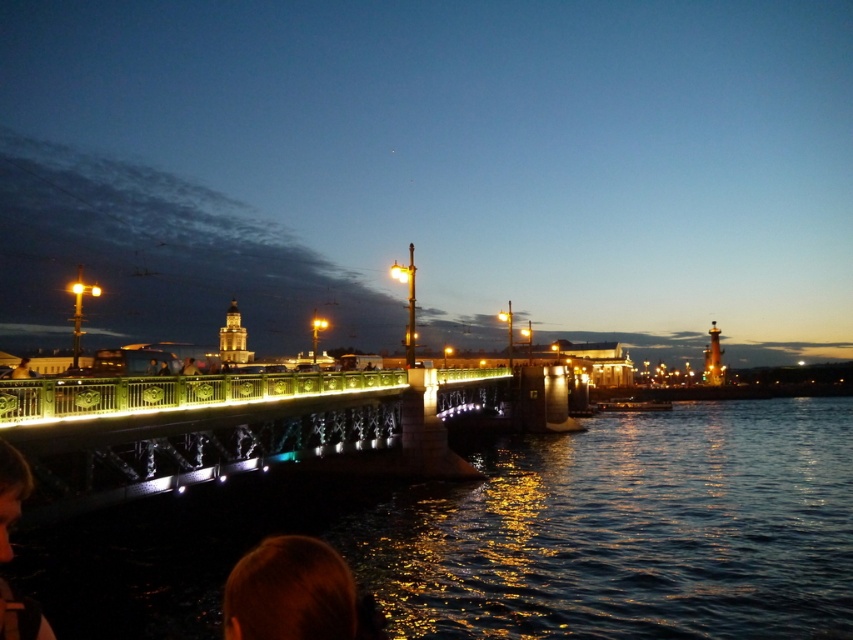
Question: Does illuminated metal bridge at center have a lesser width compared to light brown hair at lower left?

Choices:
 (A) yes
 (B) no

Answer: (B)

Question: Which point is closer to the camera taking this photo?

Choices:
 (A) (39, 624)
 (B) (167, 476)
 (C) (329, 636)

Answer: (A)

Question: Can you confirm if illuminated metal bridge at center is positioned above light brown hair at lower left?

Choices:
 (A) no
 (B) yes

Answer: (A)

Question: Estimate the real-world distances between objects in this image. Which object is closer to the brown hair at lower center?

Choices:
 (A) light brown hair at lower left
 (B) illuminated metal bridge at center

Answer: (A)

Question: Among these objects, which one is nearest to the camera?

Choices:
 (A) brown hair at lower center
 (B) illuminated metal bridge at center

Answer: (A)

Question: Can you confirm if brown hair at lower center is positioned to the right of light brown hair at lower left?

Choices:
 (A) no
 (B) yes

Answer: (B)